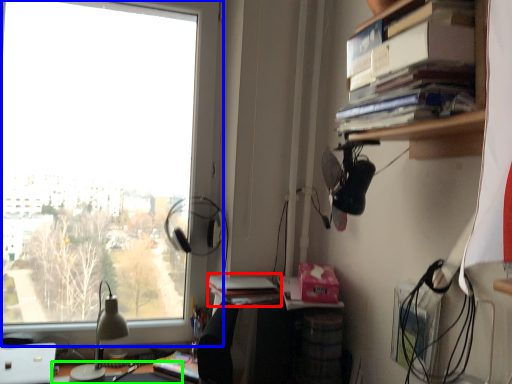
Question: Considering the real-world distances, which object is closest to book (highlighted by a red box)? window (highlighted by a blue box) or desk (highlighted by a green box).

Choices:
 (A) window
 (B) desk

Answer: (B)